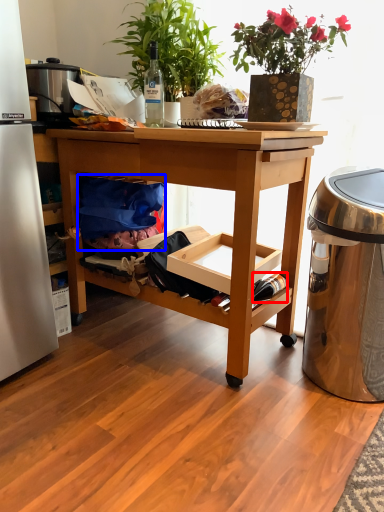
Question: Which object appears farthest to the camera in this image, bottle (highlighted by a red box) or material (highlighted by a blue box)?

Choices:
 (A) bottle
 (B) material

Answer: (B)